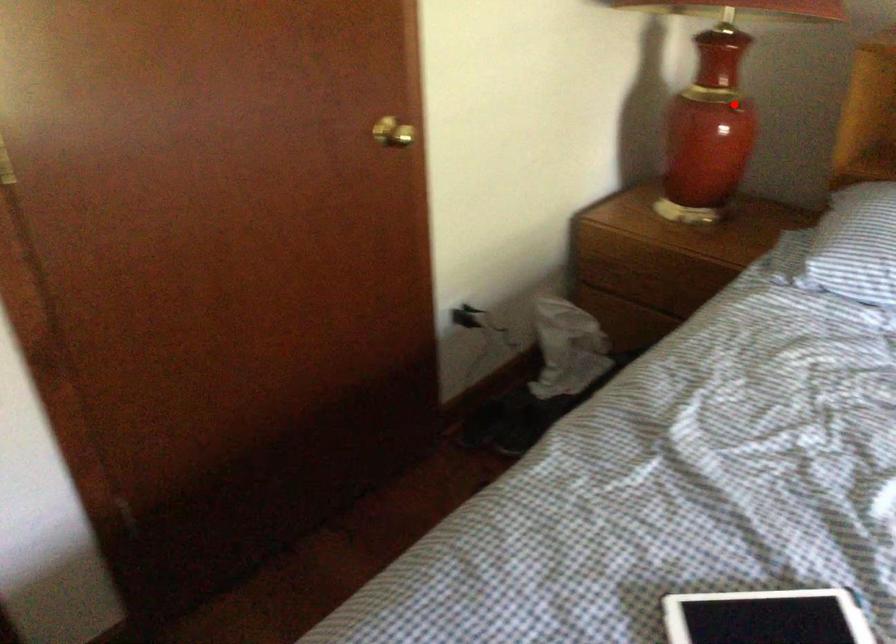
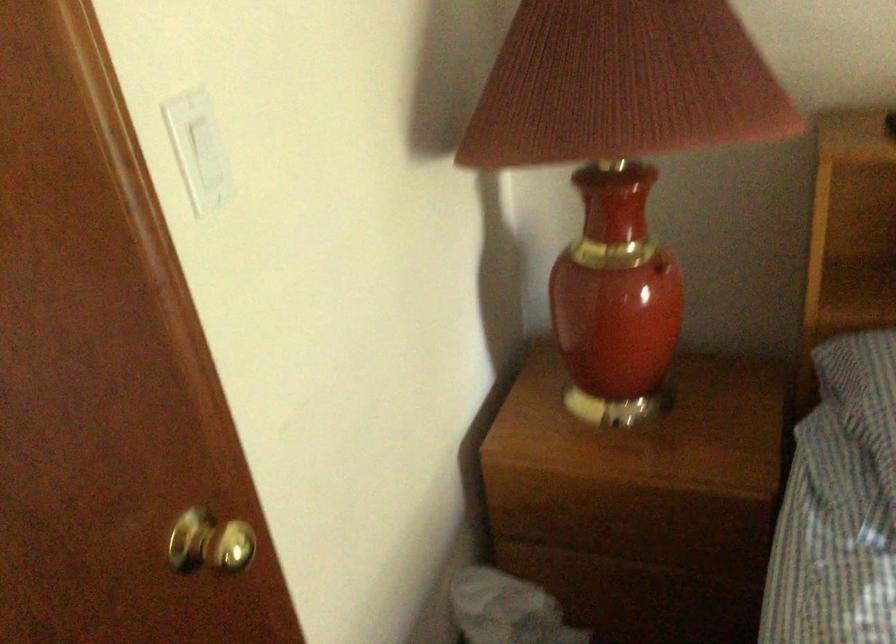
Question: I am providing you with two images of the same scene from different viewpoints. In image1, a red point is highlighted. Considering the same 3D point in image2, which of the following is correct?

Choices:
 (A) It is closer
 (B) It is farther

Answer: (A)